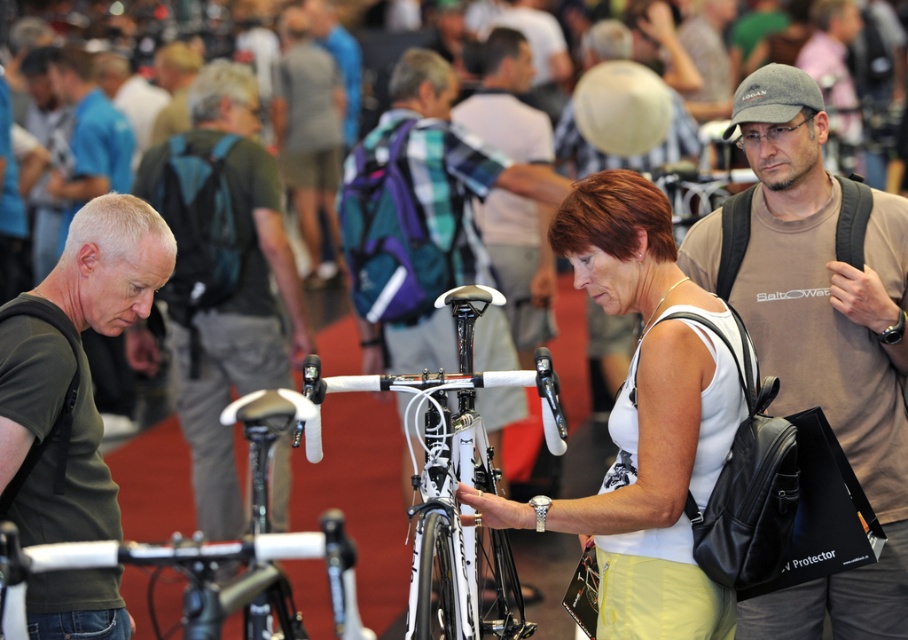
Question: Estimate the real-world distances between objects in this image. Which object is closer to the green matte t-shirt at left?

Choices:
 (A) white matte bicycle handlebars at center
 (B) dark green t-shirt at left

Answer: (A)

Question: Can you confirm if brown cotton t-shirt at center-right is wider than white matte bicycle handlebars at center?

Choices:
 (A) no
 (B) yes

Answer: (B)

Question: Among these points, which one is farthest from the camera?

Choices:
 (A) (462, 593)
 (B) (595, 545)
 (C) (16, 548)

Answer: (A)

Question: Which of the following is the farthest from the observer?

Choices:
 (A) (260, 458)
 (B) (426, 371)
 (C) (143, 227)

Answer: (B)

Question: Is brown cotton t-shirt at center-right positioned before white matte tank top at center?

Choices:
 (A) no
 (B) yes

Answer: (A)

Question: Does green fabric backpack at center have a larger size compared to dark green t-shirt at left?

Choices:
 (A) yes
 (B) no

Answer: (A)